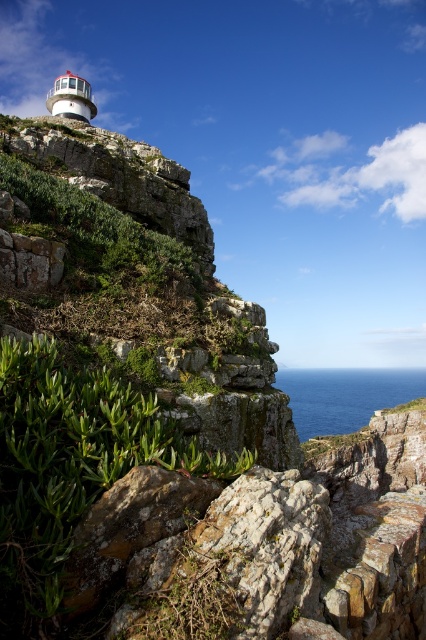
Question: Which of the following is the farthest from the observer?

Choices:
 (A) blue water at lower center
 (B) green leafy plant at center

Answer: (A)

Question: Which point is closer to the camera taking this photo?

Choices:
 (A) (71, 429)
 (B) (316, 371)

Answer: (A)

Question: Can you confirm if green leafy plant at center is bigger than blue water at lower center?

Choices:
 (A) yes
 (B) no

Answer: (B)

Question: Is green leafy plant at center to the right of blue water at lower center from the viewer's perspective?

Choices:
 (A) no
 (B) yes

Answer: (A)

Question: Observing the image, what is the correct spatial positioning of green leafy plant at center in reference to blue water at lower center?

Choices:
 (A) above
 (B) below

Answer: (A)